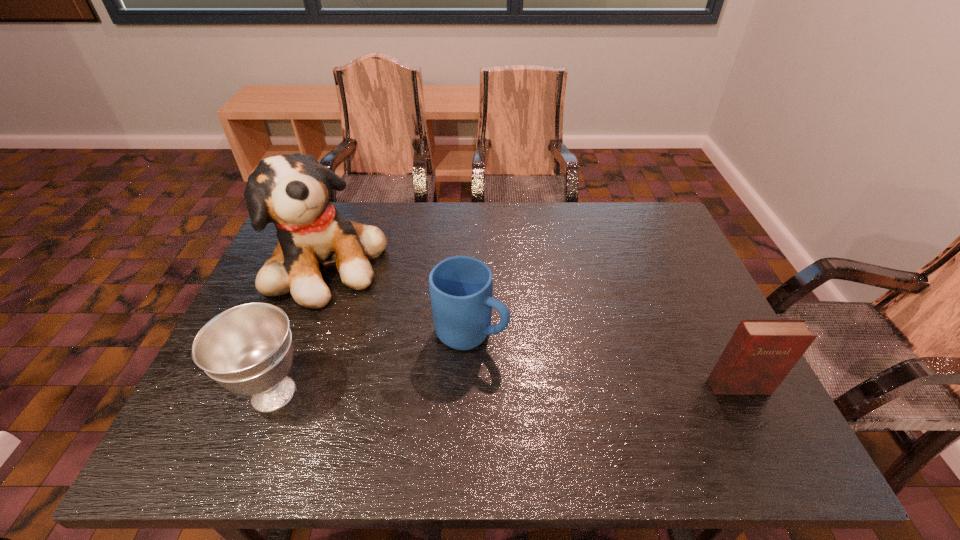
The height and width of the screenshot is (540, 960). What are the coordinates of `vacant space on the desktop that is between the chalice and the diary and is positioned at the face of the puppy` in the screenshot? It's located at (491, 390).

Identify the location of free space on the desktop that is between the chalice and the rightmost object and is positioned on the side of the mug with the handle. The width and height of the screenshot is (960, 540). (573, 389).